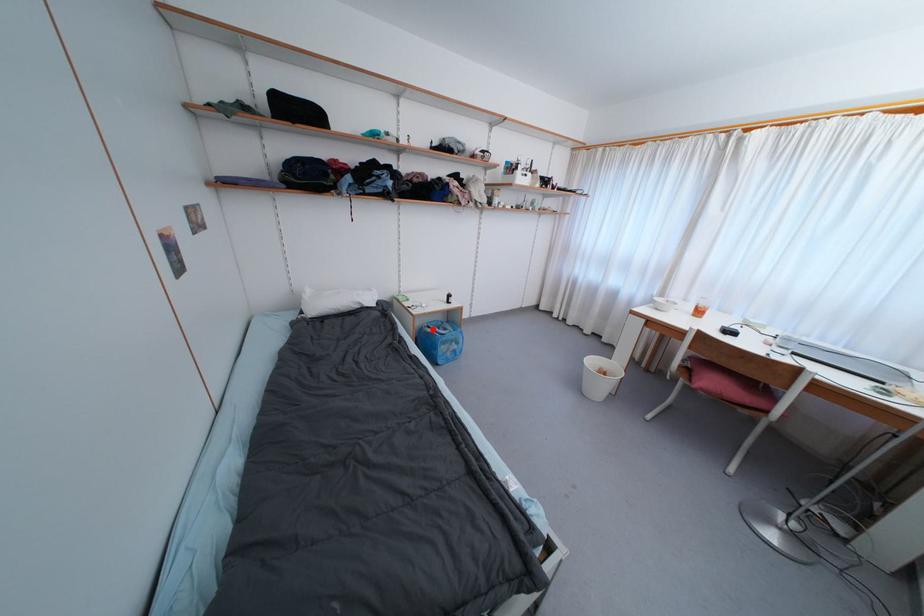
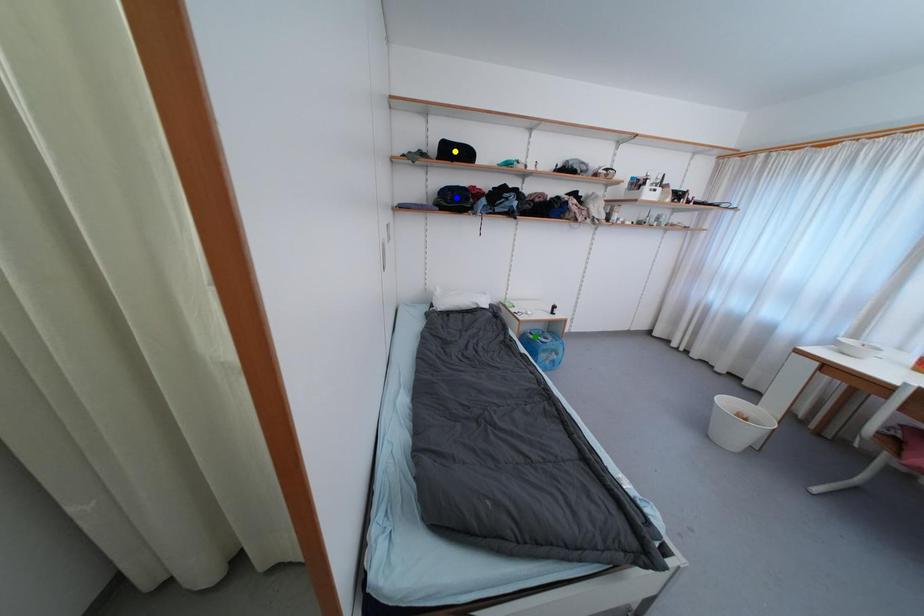
Question: I am providing you with two images of the same scene from different viewpoints. A red point is marked on the first image. You are given multiple points on the second image. Which mark in image 2 goes with the point in image 1?

Choices:
 (A) blue point
 (B) green point
 (C) yellow point

Answer: (B)